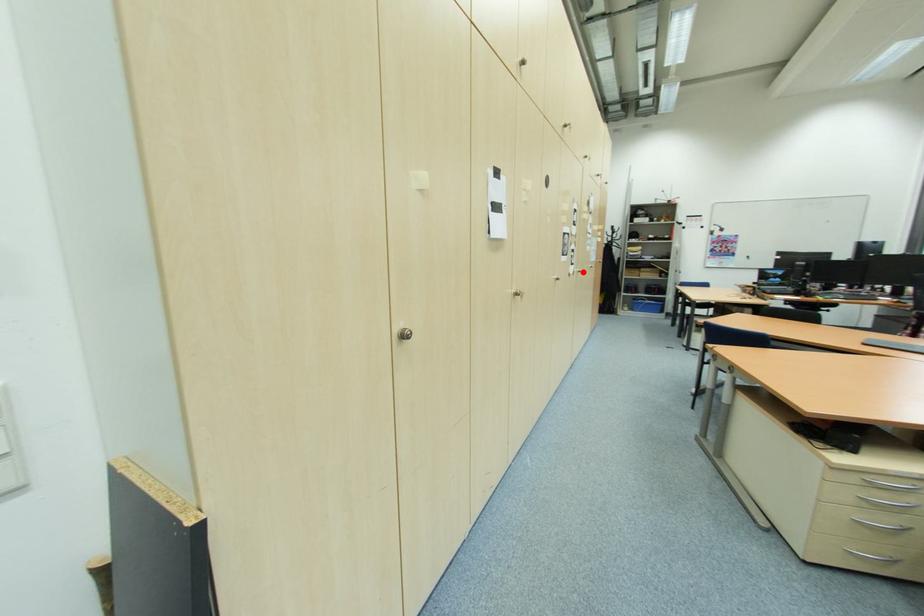
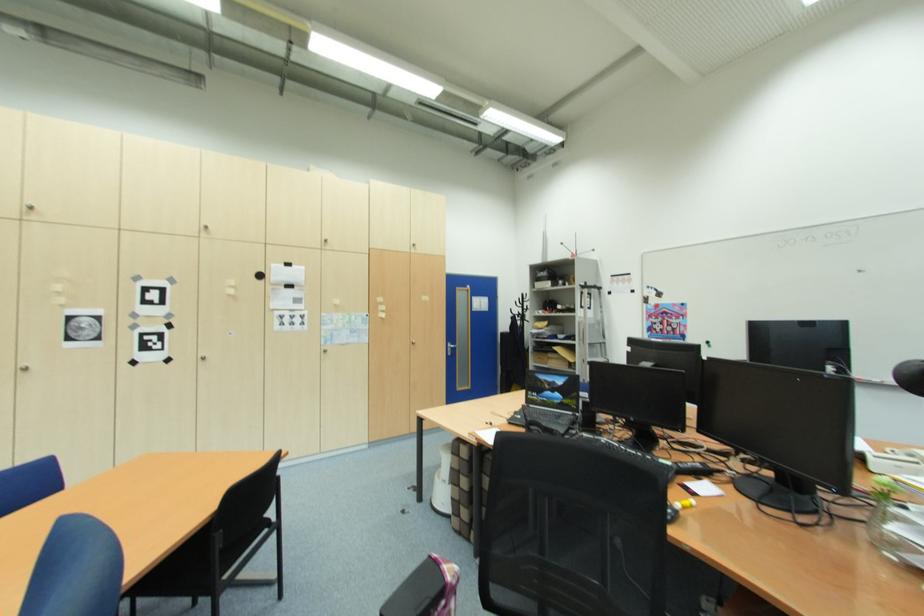
In the second image, find the point that corresponds to the highlighted location in the first image.

(208, 360)